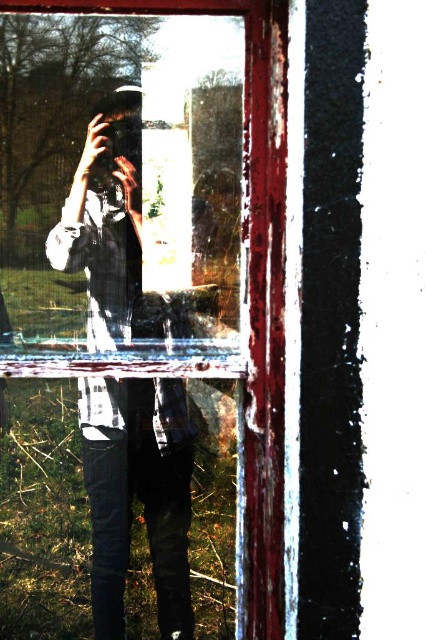
You are trying to take a photo using the matte black camera at center through the chipped paint window frame at center. Can the camera fit entirely within the window frame?

The matte black camera at center is shorter than chipped paint window frame at center, so yes, the camera can fit entirely within the window frame since it is smaller in height.

What is the color of the object located at the coordinates point (x=138, y=493)?

The point (x=138, y=493) corresponds to the matte black camera at center, so the color is matte black.

You are standing in front of the window with a red frame and looking through it. There are two points marked on the window glass at coordinates point (118,300) and point (250,596). If you want to touch both points with your finger without moving your hand, which point should you reach for first?

You should reach for point (118,300) first because it is closer to you than point (250,596), which is further away.